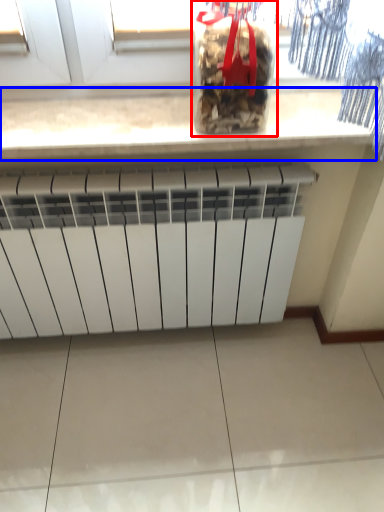
Question: Which object appears closest to the camera in this image, wine bottle (highlighted by a red box) or countertop (highlighted by a blue box)?

Choices:
 (A) wine bottle
 (B) countertop

Answer: (A)